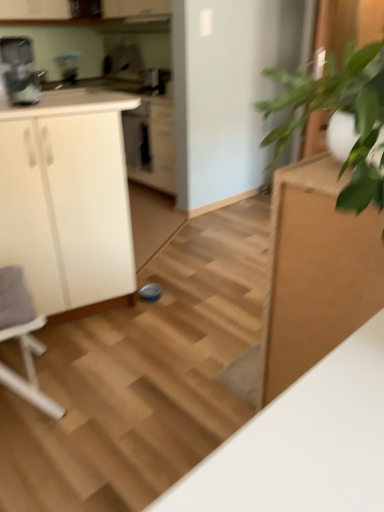
Identify the location of white plastic rocking chair at left. (22, 338).

Locate an element on the screen. Image resolution: width=384 pixels, height=512 pixels. satin black coffee maker at upper center is located at coordinates (155, 80).

Find the location of a particular element. This screenshot has width=384, height=512. green leafy plant at right is located at coordinates (336, 110).

Where is `white plastic rocking chair at left`? The width and height of the screenshot is (384, 512). white plastic rocking chair at left is located at coordinates (22, 338).

What's the angular difference between satin black coffee maker at upper center and white plastic rocking chair at left's facing directions?

satin black coffee maker at upper center and white plastic rocking chair at left are facing 165 degrees away from each other.

Considering the sizes of objects satin black coffee maker at upper center and white plastic rocking chair at left in the image provided, who is bigger, satin black coffee maker at upper center or white plastic rocking chair at left?

Bigger between the two is white plastic rocking chair at left.

From the picture: Considering the sizes of objects satin black coffee maker at upper center and white plastic rocking chair at left in the image provided, who is thinner, satin black coffee maker at upper center or white plastic rocking chair at left?

satin black coffee maker at upper center is thinner.

Does satin black coffee maker at upper center have a greater height compared to white plastic rocking chair at left?

No.

Is white plastic rocking chair at left positioned beyond the bounds of wooden stair at center?

Yes, white plastic rocking chair at left is located beyond the bounds of wooden stair at center.

Could you tell me if white plastic rocking chair at left is facing wooden stair at center?

No, white plastic rocking chair at left is not aimed at wooden stair at center.

From a real-world perspective, is white plastic rocking chair at left above or below wooden stair at center?

In terms of real-world spatial position, white plastic rocking chair at left is above wooden stair at center.

Is white plastic rocking chair at left smaller than wooden stair at center?

Yes, white plastic rocking chair at left is smaller than wooden stair at center.

Is green leafy plant at right taller or shorter than white matte cabinet at left?

Clearly, green leafy plant at right is shorter compared to white matte cabinet at left.

Can we say green leafy plant at right lies outside white matte cabinet at left?

green leafy plant at right lies outside white matte cabinet at left's area.

Relative to white matte cabinet at left, is green leafy plant at right in front or behind?

Visually, green leafy plant at right is located in front of white matte cabinet at left.

Which object is further away from the camera taking this photo, white plastic rocking chair at left or metallic silver coffee machine at upper left?

metallic silver coffee machine at upper left is further away from the camera.

Find the location of a particular element. Image resolution: width=384 pixels, height=512 pixels. rocking chair below the metallic silver coffee machine at upper left (from the image's perspective) is located at coordinates (22, 338).

Looking at the image, does white plastic rocking chair at left seem bigger or smaller compared to metallic silver coffee machine at upper left?

white plastic rocking chair at left is bigger than metallic silver coffee machine at upper left.

Is white plastic rocking chair at left positioned with its back to metallic silver coffee machine at upper left?

No, white plastic rocking chair at left's orientation is not away from metallic silver coffee machine at upper left.

In the scene shown: From the image's perspective, is white plastic rocking chair at left above or below green leafy plant at right?

white plastic rocking chair at left is below green leafy plant at right.

Is point (23, 307) positioned after point (353, 177)?

Yes, point (23, 307) is farther from viewer.

Can green leafy plant at right be found inside white plastic rocking chair at left?

No, white plastic rocking chair at left does not contain green leafy plant at right.

Which object is wider, white plastic rocking chair at left or green leafy plant at right?

With larger width is green leafy plant at right.

Which is correct: green leafy plant at right is inside wooden stair at center, or outside of it?

The correct answer is: outside.

From the image's perspective, is green leafy plant at right beneath wooden stair at center?

Incorrect, from the image's perspective, green leafy plant at right is higher than wooden stair at center.

Is green leafy plant at right next to wooden stair at center and touching it?

green leafy plant at right and wooden stair at center are not in contact.

Is green leafy plant at right facing away from wooden stair at center?

green leafy plant at right does not have its back to wooden stair at center.

Between wooden stair at center and white plastic rocking chair at left, which one is positioned in front?

white plastic rocking chair at left is closer to the camera.

From a real-world perspective, is wooden stair at center located higher than white plastic rocking chair at left?

No, from a real-world perspective, wooden stair at center is not over white plastic rocking chair at left

Considering the positions of objects wooden stair at center and white plastic rocking chair at left in the image provided, who is more to the right, wooden stair at center or white plastic rocking chair at left?

Positioned to the right is wooden stair at center.

Considering the sizes of objects wooden stair at center and white plastic rocking chair at left in the image provided, who is thinner, wooden stair at center or white plastic rocking chair at left?

white plastic rocking chair at left is thinner.

This screenshot has height=512, width=384. I want to click on rocking chair lying in front of the satin black coffee maker at upper center, so (22, 338).

Locate an element on the screen. rocking chair below the wooden stair at center (from the image's perspective) is located at coordinates (22, 338).

When comparing their distances from satin black dishwasher at center, does white matte cabinet at left or white plastic rocking chair at left seem further?

white plastic rocking chair at left.

Looking at the image, which one is located closer to satin black coffee maker at upper center, wooden stair at center or satin black dishwasher at center?

satin black dishwasher at center is closer to satin black coffee maker at upper center.

Considering their positions, is satin black coffee maker at upper center positioned further to white matte cabinet at left than satin black dishwasher at center?

The object further to white matte cabinet at left is satin black coffee maker at upper center.

Considering their positions, is satin black dishwasher at center positioned closer to wooden stair at center than white matte cabinet at left?

white matte cabinet at left is closer to wooden stair at center.

Based on their spatial positions, is wooden stair at center or green leafy plant at right further from satin black coffee maker at upper center?

The object further to satin black coffee maker at upper center is green leafy plant at right.

When comparing their distances from white plastic rocking chair at left, does metallic silver coffee machine at upper left or white matte cabinet at left seem closer?

white matte cabinet at left.

Considering their positions, is white matte cabinet at left positioned closer to metallic silver coffee machine at upper left than satin black coffee maker at upper center?

Based on the image, satin black coffee maker at upper center appears to be nearer to metallic silver coffee machine at upper left.

Looking at the image, which one is located closer to metallic silver coffee machine at upper left, green leafy plant at right or white matte cabinet at left?

white matte cabinet at left is closer to metallic silver coffee machine at upper left.

The width and height of the screenshot is (384, 512). Find the location of `dish washer positioned between white plastic rocking chair at left and satin black coffee maker at upper center from near to far`. dish washer positioned between white plastic rocking chair at left and satin black coffee maker at upper center from near to far is located at coordinates (137, 136).

You are a GUI agent. You are given a task and a screenshot of the screen. Output one action in this format:
    pyautogui.click(x=<x>, y=<y>)
    Task: Click on the coffee machine between white plastic rocking chair at left and green leafy plant at right in the horizontal direction
    The width and height of the screenshot is (384, 512).
    Given the screenshot: What is the action you would take?
    pyautogui.click(x=19, y=71)

At what (x,y) coordinates should I click in order to perform the action: click on stair located between green leafy plant at right and white matte cabinet at left in the depth direction. Please return your answer as a coordinate pair (x, y). Looking at the image, I should click on (142, 377).

At what (x,y) coordinates should I click in order to perform the action: click on cabinetry located between wooden stair at center and satin black dishwasher at center in the depth direction. Please return your answer as a coordinate pair (x, y). The height and width of the screenshot is (512, 384). Looking at the image, I should click on (67, 198).